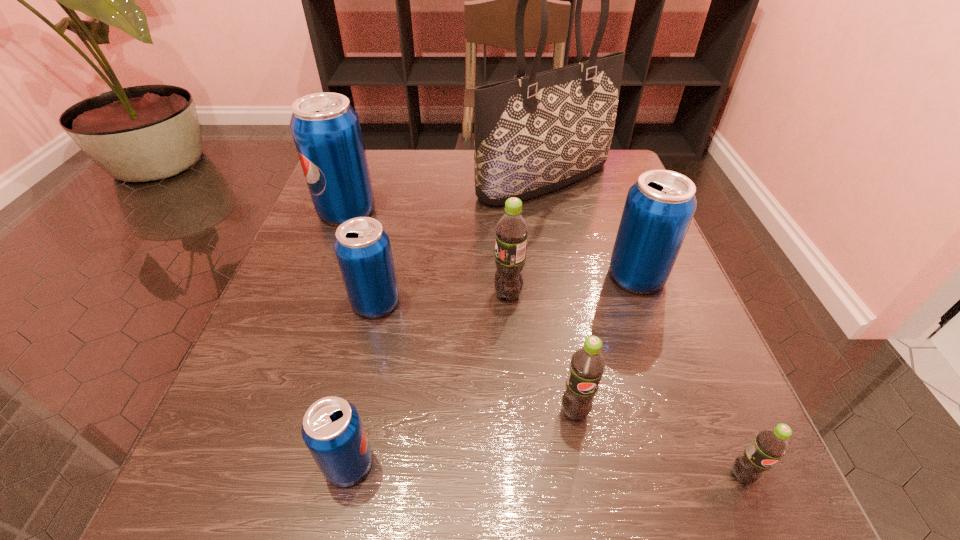
I want to click on green soda that is the second closest to the nearest green soda, so click(512, 231).

Locate which green soda is the third closest to the farthest soda. Please provide its 2D coordinates. Your answer should be formatted as a tuple, i.e. [(x, y)], where the tuple contains the x and y coordinates of a point satisfying the conditions above.

[(769, 445)]

Image resolution: width=960 pixels, height=540 pixels. In order to click on free space that satisfies the following two spatial constraints: 1. on the front side of the tote bag; 2. on the front label of the biggest green soda in this screenshot , I will do `click(566, 294)`.

Locate an element on the screen. This screenshot has height=540, width=960. free region that satisfies the following two spatial constraints: 1. on the front side of the tote bag; 2. on the front label of the biggest green soda is located at coordinates pyautogui.click(x=566, y=294).